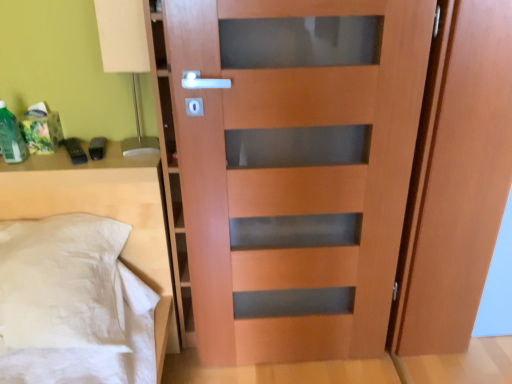
Where is `blank area to the left of white matte table lamp at upper left`? blank area to the left of white matte table lamp at upper left is located at coordinates (99, 154).